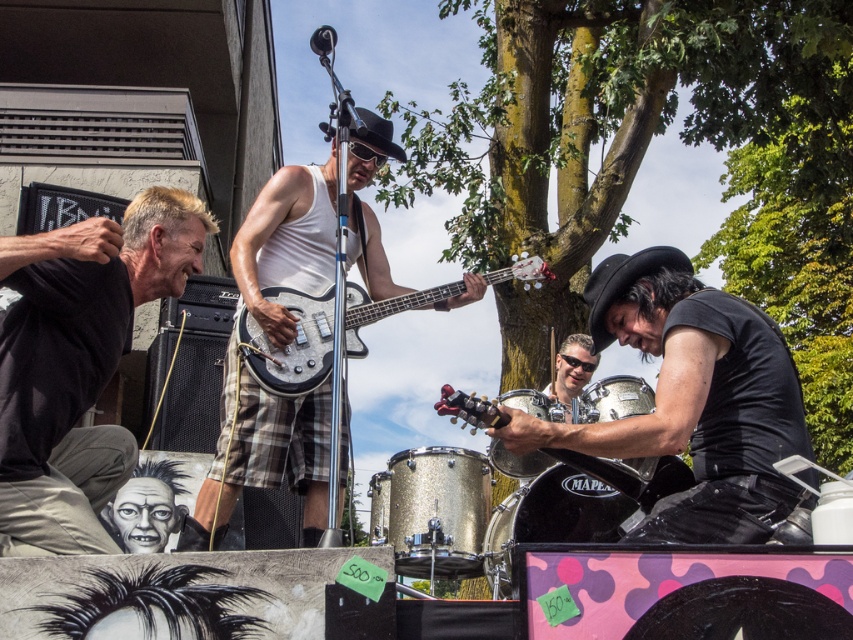
Question: Can you confirm if metallic silver guitar at center is positioned below sunglassesmaterial at center?

Choices:
 (A) yes
 (B) no

Answer: (B)

Question: Can you confirm if black matte guitar at center is positioned above sunglassesmaterial at center?

Choices:
 (A) yes
 (B) no

Answer: (A)

Question: Does black matte shirt at lower left appear over sunglassesmaterial at center?

Choices:
 (A) yes
 (B) no

Answer: (A)

Question: Which of the following is the farthest from the observer?

Choices:
 (A) (566, 358)
 (B) (305, 371)

Answer: (A)

Question: Which point appears closest to the camera in this image?

Choices:
 (A) (10, 250)
 (B) (276, 298)
 (C) (569, 419)
 (D) (730, 424)

Answer: (A)

Question: Among these objects, which one is farthest from the camera?

Choices:
 (A) black matte guitar at center
 (B) sunglassesmaterial at center

Answer: (B)